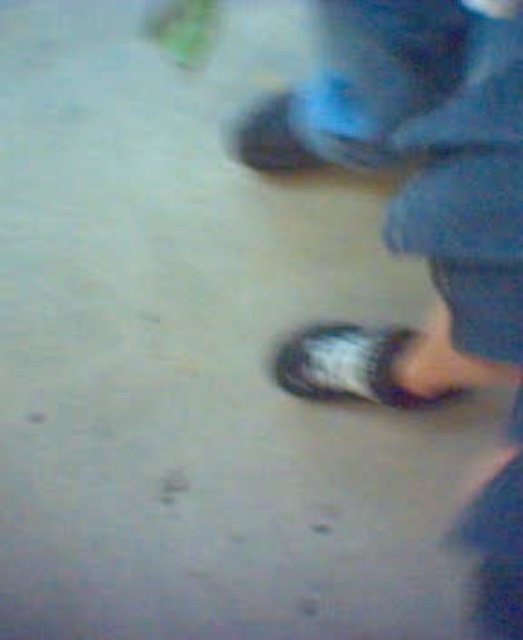
Between white textured sandal at lower center and matte blue shoe at upper center, which one has less height?

white textured sandal at lower center is shorter.

Is white textured sandal at lower center taller than matte blue shoe at upper center?

In fact, white textured sandal at lower center may be shorter than matte blue shoe at upper center.

Which is in front, point (395, 340) or point (243, 150)?

Point (395, 340)

This screenshot has height=640, width=523. What are the coordinates of `white textured sandal at lower center` in the screenshot? It's located at (348, 365).

This screenshot has height=640, width=523. Find the location of `black rubber sandals at lower center`. black rubber sandals at lower center is located at coordinates (433, 230).

Is black rubber sandals at lower center behind white textured sandal at lower center?

No, it is not.

Between point (314, 355) and point (365, 378), which one is positioned in front?

Point (365, 378)

Where is `black rubber sandals at lower center`? This screenshot has width=523, height=640. black rubber sandals at lower center is located at coordinates (433, 230).

Is point (369, 42) positioned after point (289, 104)?

No.

Is point (498, 545) behind point (293, 170)?

No.

Find the location of a particular element. black rubber sandals at lower center is located at coordinates (433, 230).